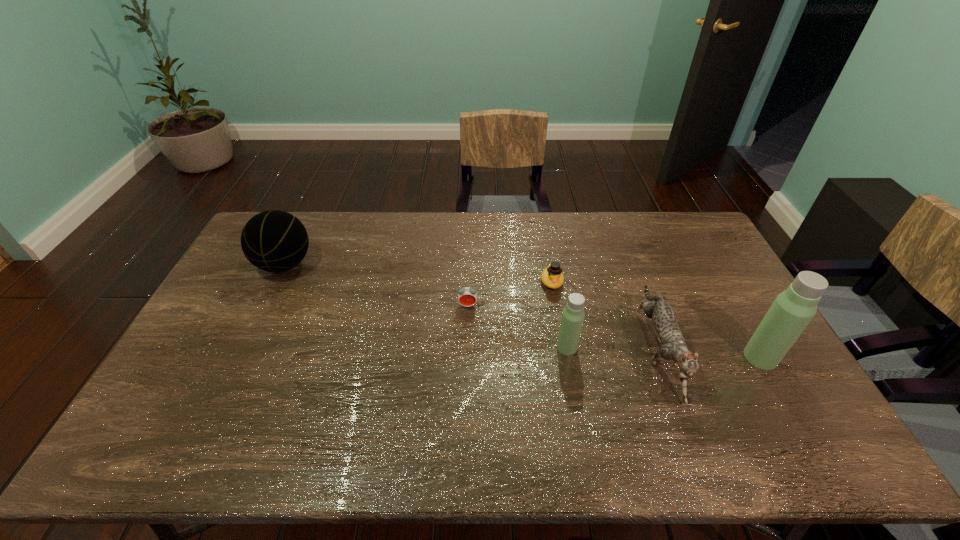
In order to click on vacant space situated 0.300m on the right of the leftmost object in this screenshot , I will do `click(401, 265)`.

In order to click on free space located 0.070m on the front-facing side of the duck in this screenshot , I will do `click(557, 309)`.

Locate an element on the screen. free space located 0.090m on the face of the second object from left to right is located at coordinates (467, 332).

Locate an element on the screen. The width and height of the screenshot is (960, 540). object that is at the far edge is located at coordinates (275, 241).

Locate an element on the screen. object situated at the near edge is located at coordinates (673, 346).

Locate an element on the screen. object positioned at the left edge is located at coordinates (275, 241).

At what (x,y) coordinates should I click in order to perform the action: click on object that is at the right edge. Please return your answer as a coordinate pair (x, y). Looking at the image, I should click on (792, 310).

Identify the location of object positioned at the far left corner. (275, 241).

The height and width of the screenshot is (540, 960). In the image, there is a desktop. Identify the location of vacant region at the far edge. (650, 238).

The height and width of the screenshot is (540, 960). In the image, there is a desktop. What are the coordinates of `vacant region at the near edge` in the screenshot? It's located at (571, 397).